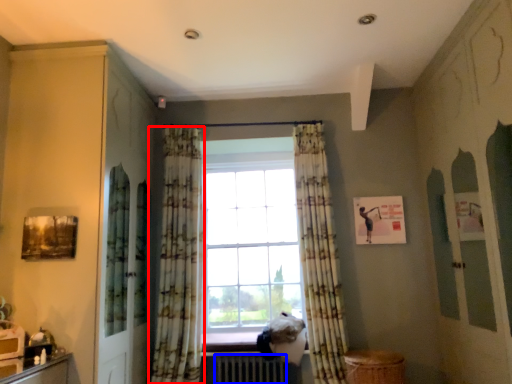
Question: Among these objects, which one is farthest to the camera, curtain (highlighted by a red box) or radiator (highlighted by a blue box)?

Choices:
 (A) curtain
 (B) radiator

Answer: (B)